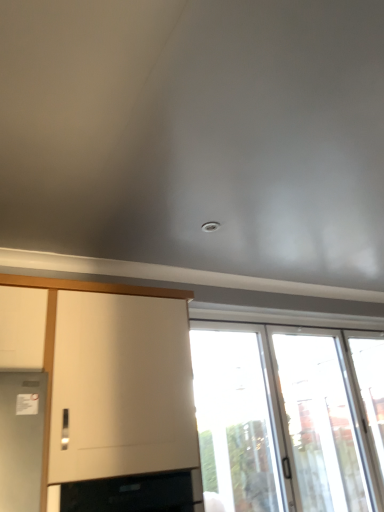
Identify the location of transparent glass window at lower right, the 1th window in the left-to-right sequence. The image size is (384, 512). (278, 420).

Describe the element at coordinates (370, 394) in the screenshot. I see `transparent glass door at right, which is counted as the 2th window, starting from the left` at that location.

This screenshot has width=384, height=512. Identify the location of transparent glass door at right, which is counted as the 2th window, starting from the left. [370, 394].

Find the location of a particular element. The width and height of the screenshot is (384, 512). transparent glass screen door at right is located at coordinates (320, 424).

Based on the photo, from the image's perspective, is black glass oven at lower left located beneath transparent glass window at lower right, the 1th window in the left-to-right sequence?

Incorrect, from the image's perspective, black glass oven at lower left is higher than transparent glass window at lower right, the 1th window in the left-to-right sequence.

Find the location of a particular element. This screenshot has height=512, width=384. appliance on the left of transparent glass window at lower right, which ranks as the 2th window in right-to-left order is located at coordinates (135, 493).

Can you confirm if black glass oven at lower left is smaller than transparent glass window at lower right, the 1th window in the left-to-right sequence?

Yes.

Is transparent glass window at lower right, which ranks as the 2th window in right-to-left order, bigger than transparent glass door at right, positioned as the first window in right-to-left order?

Yes.

The height and width of the screenshot is (512, 384). What are the coordinates of `window that is on the right side of transparent glass window at lower right, which ranks as the 2th window in right-to-left order` in the screenshot? It's located at (370, 394).

Which is behind, point (258, 332) or point (375, 362)?

The point (375, 362) is behind.

How different are the orientations of transparent glass screen door at right and transparent glass window at lower right, which ranks as the 2th window in right-to-left order, in degrees?

They differ by 1.93 degrees in their facing directions.

Considering the relative sizes of transparent glass screen door at right and transparent glass window at lower right, which ranks as the 2th window in right-to-left order, in the image provided, is transparent glass screen door at right bigger than transparent glass window at lower right, which ranks as the 2th window in right-to-left order,?

Incorrect, transparent glass screen door at right is not larger than transparent glass window at lower right, which ranks as the 2th window in right-to-left order.

Are transparent glass screen door at right and transparent glass window at lower right, which ranks as the 2th window in right-to-left order, located far from each other?

No, there isn't a large distance between transparent glass screen door at right and transparent glass window at lower right, which ranks as the 2th window in right-to-left order.

The width and height of the screenshot is (384, 512). In order to click on screen door to the right of transparent glass window at lower right, which ranks as the 2th window in right-to-left order in this screenshot , I will do `click(320, 424)`.

This screenshot has width=384, height=512. In order to click on window in front of the transparent glass door at right, which is counted as the 2th window, starting from the left in this screenshot , I will do `click(278, 420)`.

Is transparent glass door at right, positioned as the first window in right-to-left order, to the right of transparent glass window at lower right, the 1th window in the left-to-right sequence, from the viewer's perspective?

Yes.

Between transparent glass door at right, which is counted as the 2th window, starting from the left, and transparent glass window at lower right, the 1th window in the left-to-right sequence, which one has less height?

transparent glass door at right, which is counted as the 2th window, starting from the left, is shorter.

Is transparent glass door at right, positioned as the first window in right-to-left order, outside of transparent glass window at lower right, which ranks as the 2th window in right-to-left order?

Actually, transparent glass door at right, positioned as the first window in right-to-left order, is at least partially inside transparent glass window at lower right, which ranks as the 2th window in right-to-left order.

Does transparent glass screen door at right appear on the right side of black glass oven at lower left?

Correct, you'll find transparent glass screen door at right to the right of black glass oven at lower left.

Which point is more forward, (300, 465) or (68, 488)?

The point (68, 488) is closer.

Is transparent glass screen door at right not within black glass oven at lower left?

transparent glass screen door at right lies outside black glass oven at lower left's area.

From the image's perspective, is transparent glass screen door at right over transparent glass door at right, which is counted as the 2th window, starting from the left?

Yes, from the image's perspective, transparent glass screen door at right is over transparent glass door at right, which is counted as the 2th window, starting from the left.

What's the angular difference between transparent glass screen door at right and transparent glass door at right, positioned as the first window in right-to-left order,'s facing directions?

There is a 1.72-degree angle between the facing directions of transparent glass screen door at right and transparent glass door at right, positioned as the first window in right-to-left order.

Between transparent glass screen door at right and transparent glass door at right, positioned as the first window in right-to-left order, which one has more height?

transparent glass screen door at right.

Considering the relative sizes of transparent glass screen door at right and transparent glass door at right, positioned as the first window in right-to-left order, in the image provided, is transparent glass screen door at right thinner than transparent glass door at right, positioned as the first window in right-to-left order,?

Correct, the width of transparent glass screen door at right is less than that of transparent glass door at right, positioned as the first window in right-to-left order.

Who is taller, transparent glass door at right, positioned as the first window in right-to-left order, or transparent glass screen door at right?

transparent glass screen door at right is taller.

What's the angular difference between transparent glass door at right, positioned as the first window in right-to-left order, and transparent glass screen door at right's facing directions?

1.72 degrees.

From a real-world perspective, is transparent glass door at right, positioned as the first window in right-to-left order, above or below transparent glass screen door at right?

transparent glass door at right, positioned as the first window in right-to-left order, is situated higher than transparent glass screen door at right in the real world.

From a real-world perspective, count 2nd windows upward from the black glass oven at lower left and point to it. Please provide its 2D coordinates.

[(278, 420)]

Locate an element on the screen. window on the right of transparent glass window at lower right, the 1th window in the left-to-right sequence is located at coordinates (370, 394).

From the image, which object appears to be farther from transparent glass screen door at right, black glass oven at lower left or transparent glass door at right, which is counted as the 2th window, starting from the left?

Based on the image, black glass oven at lower left appears to be further to transparent glass screen door at right.

Consider the image. When comparing their distances from black glass oven at lower left, does transparent glass door at right, positioned as the first window in right-to-left order, or transparent glass screen door at right seem further?

transparent glass door at right, positioned as the first window in right-to-left order, is positioned further to the anchor black glass oven at lower left.

Looking at the image, which one is located further to transparent glass screen door at right, black glass oven at lower left or transparent glass window at lower right, which ranks as the 2th window in right-to-left order?

Based on the image, black glass oven at lower left appears to be further to transparent glass screen door at right.

Based on their spatial positions, is transparent glass door at right, which is counted as the 2th window, starting from the left, or black glass oven at lower left further from transparent glass screen door at right?

Based on the image, black glass oven at lower left appears to be further to transparent glass screen door at right.

From the image, which object appears to be farther from transparent glass door at right, which is counted as the 2th window, starting from the left, transparent glass screen door at right or transparent glass window at lower right, which ranks as the 2th window in right-to-left order?

The object further to transparent glass door at right, which is counted as the 2th window, starting from the left, is transparent glass window at lower right, which ranks as the 2th window in right-to-left order.

Estimate the real-world distances between objects in this image. Which object is further from black glass oven at lower left, transparent glass door at right, which is counted as the 2th window, starting from the left, or transparent glass window at lower right, which ranks as the 2th window in right-to-left order?

transparent glass door at right, which is counted as the 2th window, starting from the left, is positioned further to the anchor black glass oven at lower left.

From the image, which object appears to be farther from transparent glass window at lower right, the 1th window in the left-to-right sequence, black glass oven at lower left or transparent glass door at right, which is counted as the 2th window, starting from the left?

Based on the image, black glass oven at lower left appears to be further to transparent glass window at lower right, the 1th window in the left-to-right sequence.

Considering their positions, is transparent glass door at right, which is counted as the 2th window, starting from the left, positioned closer to transparent glass window at lower right, the 1th window in the left-to-right sequence, than black glass oven at lower left?

transparent glass door at right, which is counted as the 2th window, starting from the left, is closer to transparent glass window at lower right, the 1th window in the left-to-right sequence.

Image resolution: width=384 pixels, height=512 pixels. What are the coordinates of `window between black glass oven at lower left and transparent glass screen door at right` in the screenshot? It's located at (278, 420).

Where is `window located between black glass oven at lower left and transparent glass door at right, which is counted as the 2th window, starting from the left, in the left-right direction`? The image size is (384, 512). window located between black glass oven at lower left and transparent glass door at right, which is counted as the 2th window, starting from the left, in the left-right direction is located at coordinates (278, 420).

The image size is (384, 512). In order to click on screen door located between transparent glass window at lower right, which ranks as the 2th window in right-to-left order, and transparent glass door at right, positioned as the first window in right-to-left order, in the left-right direction in this screenshot , I will do `click(320, 424)`.

Find the location of a particular element. The height and width of the screenshot is (512, 384). screen door between black glass oven at lower left and transparent glass door at right, positioned as the first window in right-to-left order, in the horizontal direction is located at coordinates (320, 424).